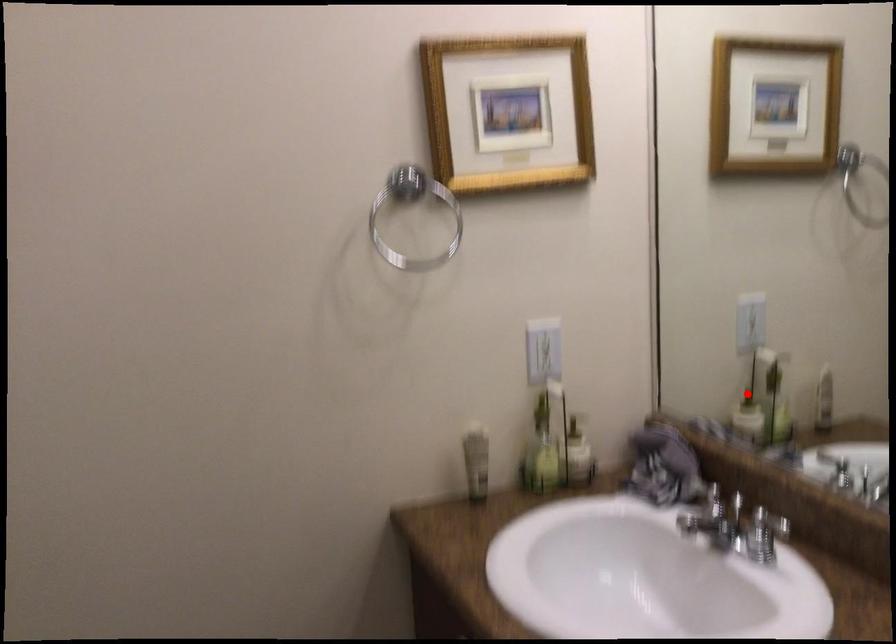
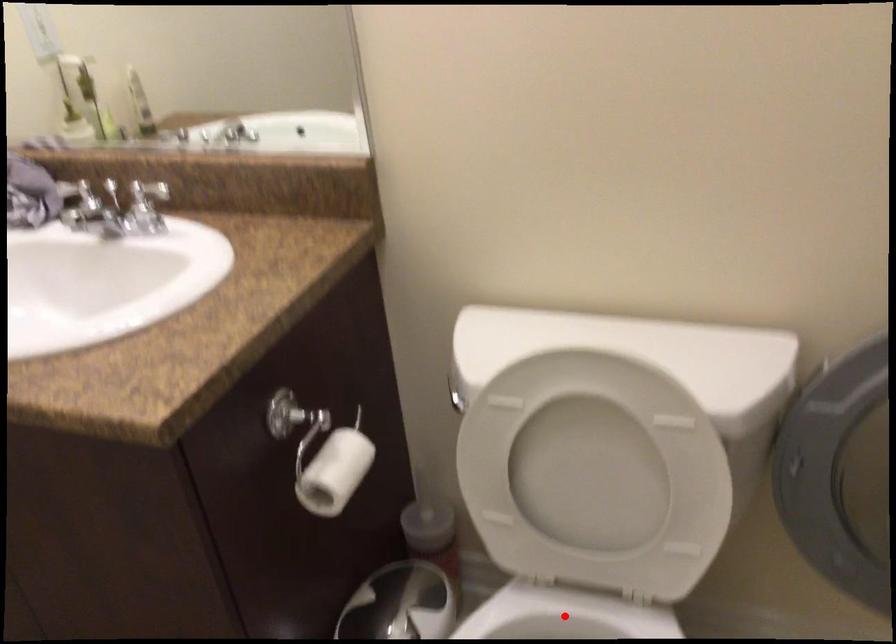
I am providing you with two images of the same scene from different viewpoints. A red point is marked on the first image and another point is marked on the second image. Are the points marked in image1 and image2 representing the same 3D position?

No